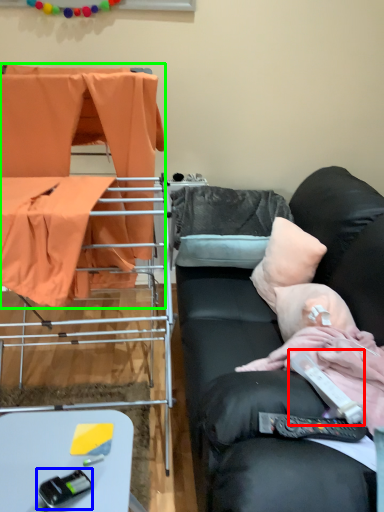
Question: Which is farther away from equipment (highlighted by a red box)? equipment (highlighted by a blue box) or furniture (highlighted by a green box)?

Choices:
 (A) equipment
 (B) furniture

Answer: (B)